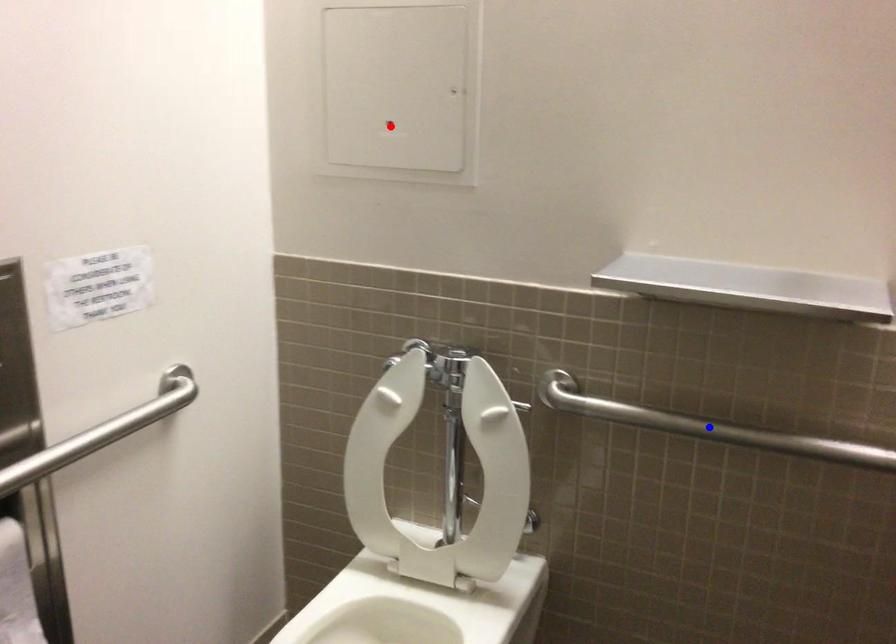
Question: Which of the two points in the image is closer to the camera?

Choices:
 (A) Blue point is closer.
 (B) Red point is closer.

Answer: (A)